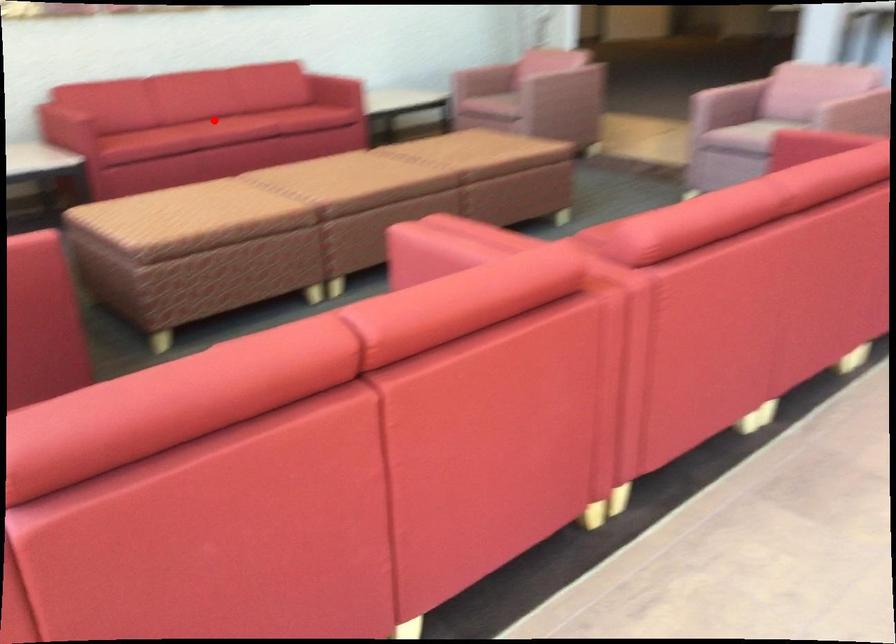
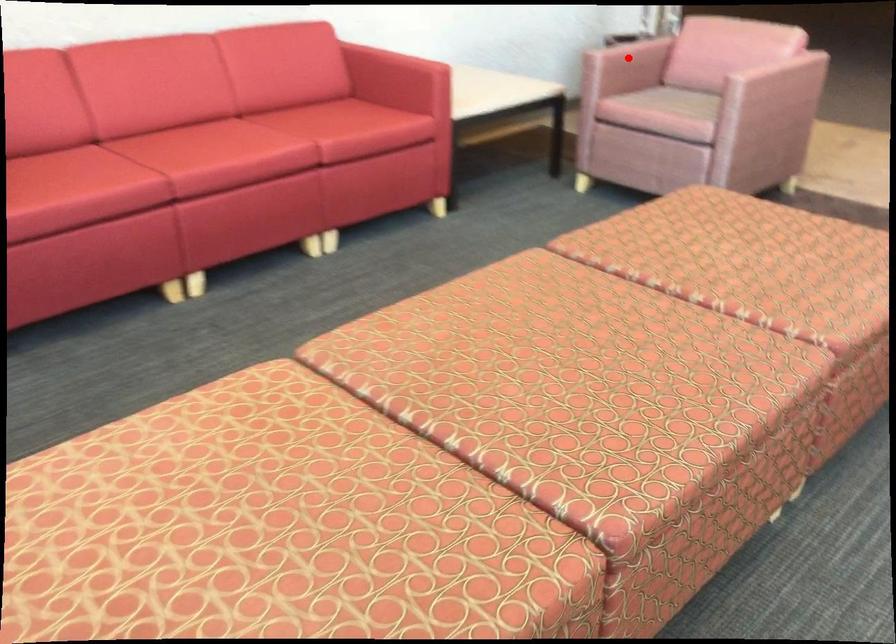
I am providing you with two images of the same scene from different viewpoints. A red point is marked on the first image and another point is marked on the second image. Are the points marked in image1 and image2 representing the same 3D position?

No